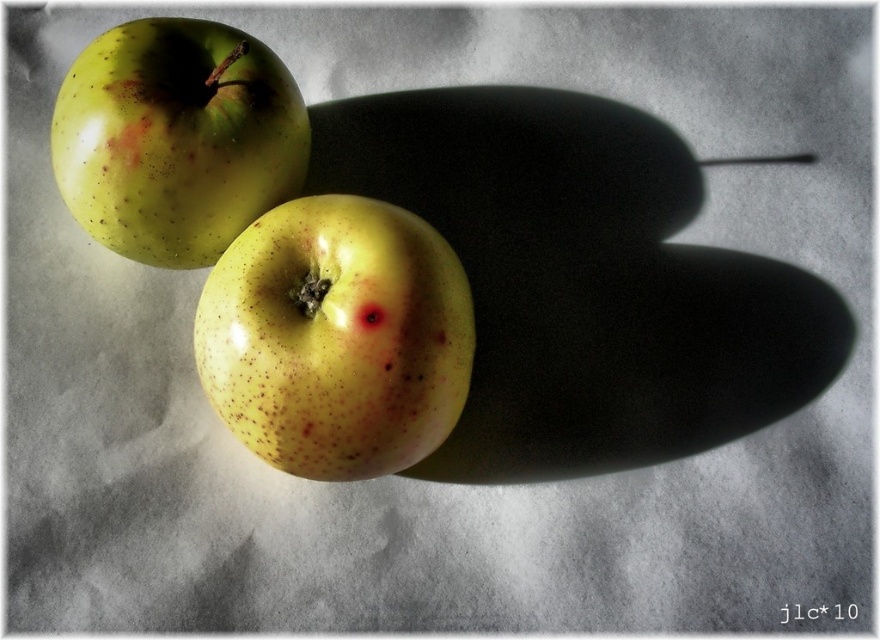
Question: Can you confirm if yellow speckled apple at center is thinner than green speckled apple at upper left?

Choices:
 (A) yes
 (B) no

Answer: (B)

Question: Which point is closer to the camera taking this photo?

Choices:
 (A) (302, 132)
 (B) (376, 472)

Answer: (B)

Question: Which of the following is the farthest from the observer?

Choices:
 (A) yellow speckled apple at center
 (B) green speckled apple at upper left

Answer: (B)

Question: Which point is closer to the camera?

Choices:
 (A) green speckled apple at upper left
 (B) yellow speckled apple at center

Answer: (B)

Question: Is yellow speckled apple at center thinner than green speckled apple at upper left?

Choices:
 (A) yes
 (B) no

Answer: (B)

Question: Is yellow speckled apple at center wider than green speckled apple at upper left?

Choices:
 (A) yes
 (B) no

Answer: (A)